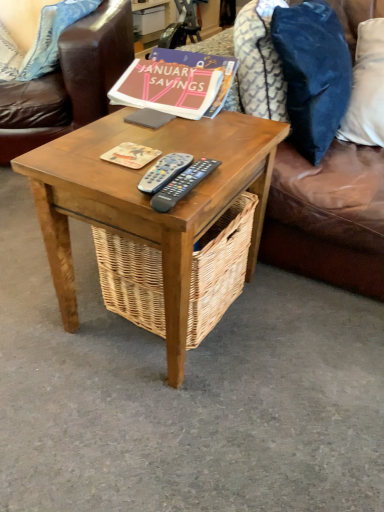
Identify the location of free location in front of matte cardboard coaster at center, which is the 1th book from front to back. (123, 179).